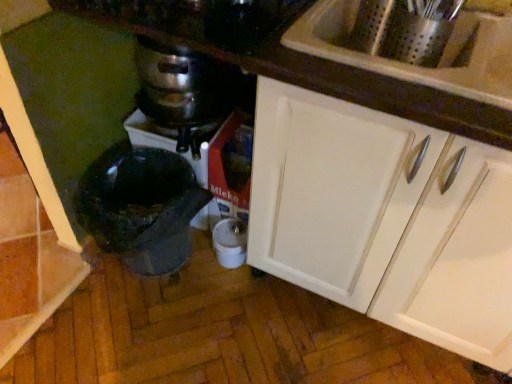
The image size is (512, 384). I want to click on free space in front of white plastic container at lower center, marked as the 2th appliance in a left-to-right arrangement, so click(225, 296).